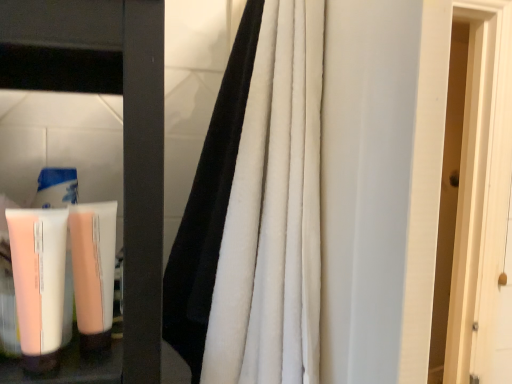
Question: From a real-world perspective, is black velvet curtain at center below pink matte tube at lower left?

Choices:
 (A) yes
 (B) no

Answer: (B)

Question: Considering the relative sizes of black velvet curtain at center and pink matte tube at lower left in the image provided, is black velvet curtain at center wider than pink matte tube at lower left?

Choices:
 (A) no
 (B) yes

Answer: (B)

Question: Is pink matte tube at lower left inside black velvet curtain at center?

Choices:
 (A) yes
 (B) no

Answer: (B)

Question: From a real-world perspective, is black velvet curtain at center physically above pink matte tube at lower left?

Choices:
 (A) yes
 (B) no

Answer: (A)

Question: Can you confirm if black velvet curtain at center is smaller than pink matte tube at lower left?

Choices:
 (A) yes
 (B) no

Answer: (B)

Question: From the image's perspective, relative to pink matte tube at lower left, is pale pink matte tube at lower left above or below?

Choices:
 (A) above
 (B) below

Answer: (A)

Question: Is pale pink matte tube at lower left inside or outside of pink matte tube at lower left?

Choices:
 (A) inside
 (B) outside

Answer: (B)

Question: Considering the positions of pale pink matte tube at lower left and pink matte tube at lower left in the image, is pale pink matte tube at lower left taller or shorter than pink matte tube at lower left?

Choices:
 (A) short
 (B) tall

Answer: (B)

Question: Based on their sizes in the image, would you say pale pink matte tube at lower left is bigger or smaller than pink matte tube at lower left?

Choices:
 (A) big
 (B) small

Answer: (B)

Question: Relative to pink matte tube at lower left, is black velvet curtain at center in front or behind?

Choices:
 (A) front
 (B) behind

Answer: (A)

Question: Is point (x=317, y=276) closer or farther from the camera than point (x=46, y=274)?

Choices:
 (A) farther
 (B) closer

Answer: (A)

Question: From their relative heights in the image, would you say black velvet curtain at center is taller or shorter than pink matte tube at lower left?

Choices:
 (A) tall
 (B) short

Answer: (A)

Question: Is black velvet curtain at center bigger or smaller than pink matte tube at lower left?

Choices:
 (A) small
 (B) big

Answer: (B)

Question: In terms of width, does pink matte tube at lower left look wider or thinner when compared to pale pink matte tube at lower left?

Choices:
 (A) wide
 (B) thin

Answer: (B)

Question: Is point (32, 365) positioned closer to the camera than point (109, 344)?

Choices:
 (A) farther
 (B) closer

Answer: (B)